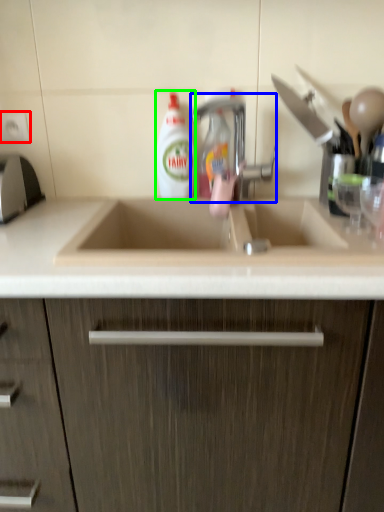
Question: Which object is the farthest from electric outlet (highlighted by a red box)? Choose among these: tap (highlighted by a blue box) or cleaning product (highlighted by a green box).

Choices:
 (A) tap
 (B) cleaning product

Answer: (A)